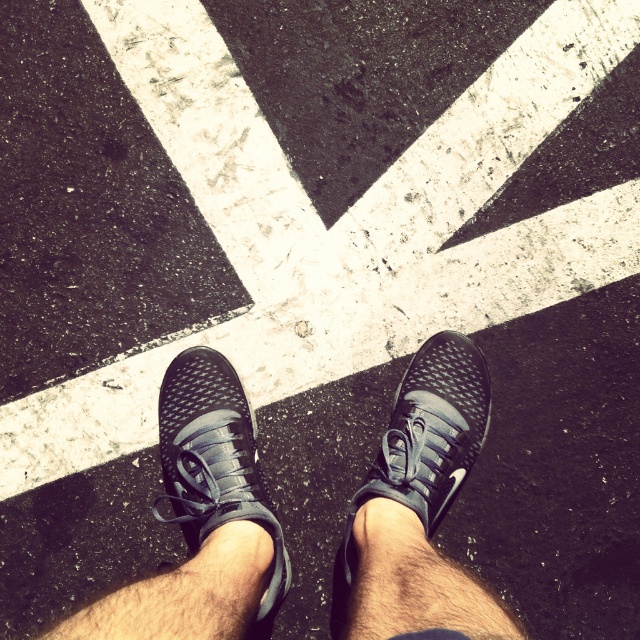
Question: Which point is closer to the camera?

Choices:
 (A) matte black shoe at center
 (B) matte black sneaker at center

Answer: (A)

Question: Is black mesh sneakers at center positioned in front of matte black sneaker at center?

Choices:
 (A) yes
 (B) no

Answer: (A)

Question: Which of these objects is positioned farthest from the matte black sneaker at center?

Choices:
 (A) black mesh sneakers at center
 (B) matte black shoe at center

Answer: (B)

Question: From the image, what is the correct spatial relationship of black mesh sneakers at center in relation to matte black shoe at center?

Choices:
 (A) below
 (B) above

Answer: (A)

Question: Does black mesh sneakers at center appear under matte black sneaker at center?

Choices:
 (A) yes
 (B) no

Answer: (A)

Question: Which point is closer to the camera?

Choices:
 (A) matte black sneaker at center
 (B) black mesh sneakers at center

Answer: (B)